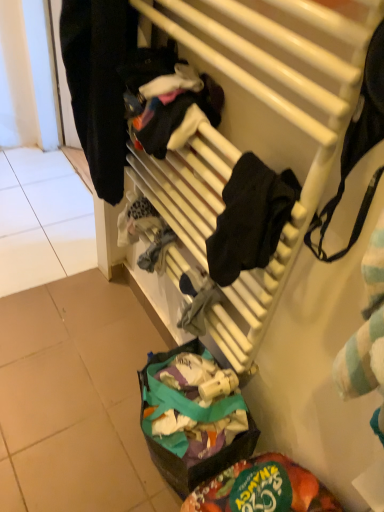
Locate an element on the screen. The height and width of the screenshot is (512, 384). green fabric bag at lower center is located at coordinates (192, 405).

This screenshot has width=384, height=512. What are the coordinates of `white matte radiator at upper center` in the screenshot? It's located at (252, 137).

Which of these two, green fabric bag at lower center or white matte radiator at upper center, is bigger?

Bigger between the two is green fabric bag at lower center.

Is green fabric bag at lower center not near white matte radiator at upper center?

green fabric bag at lower center is actually quite close to white matte radiator at upper center.

Is green fabric bag at lower center surrounding white matte radiator at upper center?

Actually, white matte radiator at upper center is outside green fabric bag at lower center.

In the scene shown: Considering the relative sizes of green fabric bag at lower center and white matte radiator at upper center in the image provided, is green fabric bag at lower center taller than white matte radiator at upper center?

In fact, green fabric bag at lower center may be shorter than white matte radiator at upper center.

From the image's perspective, which one is positioned higher, black matte clothing at left or white matte radiator at upper center?

black matte clothing at left, from the image's perspective.

Measure the distance between black matte clothing at left and white matte radiator at upper center.

They are 23.43 centimeters apart.

Is black matte clothing at left further to camera compared to white matte radiator at upper center?

Yes, it is.

Could you tell me if black matte clothing at left is facing white matte radiator at upper center?

No, black matte clothing at left is not turned towards white matte radiator at upper center.

Are black matte clothing at left and green fabric bag at lower center beside each other?

No, black matte clothing at left is not next to green fabric bag at lower center.

Measure the distance from black matte clothing at left to green fabric bag at lower center.

23.54 inches.

From the image's perspective, would you say black matte clothing at left is positioned over green fabric bag at lower center?

Indeed, from the image's perspective, black matte clothing at left is shown above green fabric bag at lower center.

From their relative heights in the image, would you say black matte clothing at left is taller or shorter than green fabric bag at lower center?

Considering their sizes, black matte clothing at left has more height than green fabric bag at lower center.

Measure the distance between white matte radiator at upper center and black matte clothing at left.

white matte radiator at upper center is 9.23 inches away from black matte clothing at left.

Is white matte radiator at upper center not within black matte clothing at left?

Yes, white matte radiator at upper center is not within black matte clothing at left.

Does white matte radiator at upper center come behind black matte clothing at left?

No, white matte radiator at upper center is closer to the camera.

From a real-world perspective, is white matte radiator at upper center below black matte clothing at left?

Yes.

Which point is more forward, (185, 402) or (109, 168)?

The point (109, 168) is in front.

Can you confirm if green fabric bag at lower center is shorter than black matte clothing at left?

Indeed, green fabric bag at lower center has a lesser height compared to black matte clothing at left.

From a real-world perspective, which object rests below the other?

green fabric bag at lower center is physically lower.

Find the location of `clothing that appears on the left of green fabric bag at lower center`. clothing that appears on the left of green fabric bag at lower center is located at coordinates (99, 84).

Considering the sizes of objects white matte radiator at upper center and green fabric bag at lower center in the image provided, who is shorter, white matte radiator at upper center or green fabric bag at lower center?

Standing shorter between the two is green fabric bag at lower center.

How much distance is there between white matte radiator at upper center and green fabric bag at lower center?

white matte radiator at upper center and green fabric bag at lower center are 14.38 inches apart from each other.

Is white matte radiator at upper center located outside green fabric bag at lower center?

white matte radiator at upper center is positioned outside green fabric bag at lower center.

Find the location of a particular element. This screenshot has height=512, width=384. food on the right of the white matte radiator at upper center is located at coordinates click(192, 405).

The width and height of the screenshot is (384, 512). In order to click on food on the right of white matte radiator at upper center in this screenshot , I will do `click(192, 405)`.

This screenshot has height=512, width=384. In order to click on clothing behind the white matte radiator at upper center in this screenshot , I will do `click(99, 84)`.

Estimate the real-world distances between objects in this image. Which object is further from green fabric bag at lower center, white matte radiator at upper center or black matte clothing at left?

black matte clothing at left.

Which object lies further to the anchor point black matte clothing at left, green fabric bag at lower center or white matte radiator at upper center?

Among the two, green fabric bag at lower center is located further to black matte clothing at left.

When comparing their distances from white matte radiator at upper center, does black matte clothing at left or green fabric bag at lower center seem further?

green fabric bag at lower center.

Based on the photo, looking at the image, which one is located further to white matte radiator at upper center, green fabric bag at lower center or black matte clothing at left?

Among the two, green fabric bag at lower center is located further to white matte radiator at upper center.

Based on their spatial positions, is black matte clothing at left or white matte radiator at upper center further from green fabric bag at lower center?

black matte clothing at left is further to green fabric bag at lower center.

From the image, which object appears to be farther from black matte clothing at left, white matte radiator at upper center or green fabric bag at lower center?

green fabric bag at lower center lies further to black matte clothing at left than the other object.

Find the location of a particular element. Image resolution: width=384 pixels, height=512 pixels. furniture between black matte clothing at left and green fabric bag at lower center in the up-down direction is located at coordinates (252, 137).